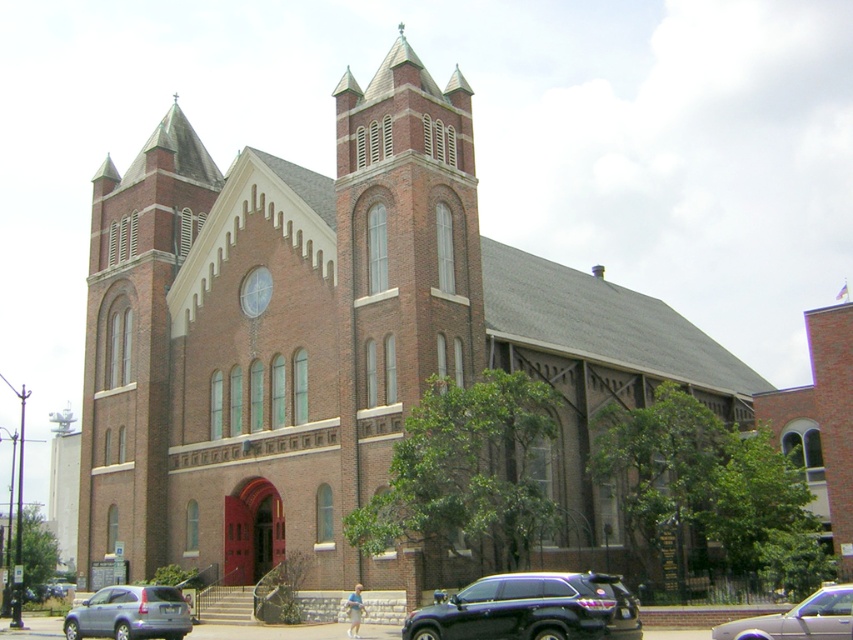
Does black matte suv at lower center appear on the left side of metallic gray suv at lower left?

Incorrect, black matte suv at lower center is not on the left side of metallic gray suv at lower left.

Between black matte suv at lower center and metallic gray suv at lower left, which one appears on the left side from the viewer's perspective?

From the viewer's perspective, metallic gray suv at lower left appears more on the left side.

Looking at this image, who is more forward, (439,620) or (181,608)?

Point (439,620) is more forward.

This screenshot has width=853, height=640. Identify the location of black matte suv at lower center. (531, 609).

Between metallic gray suv at lower left and metallic silver sedan at lower right, which one has more height?

metallic gray suv at lower left

Who is more forward, (73, 616) or (776, 621)?

Point (776, 621) is in front.

Find the location of a particular element. This screenshot has height=640, width=853. metallic gray suv at lower left is located at coordinates (129, 612).

Does black matte suv at lower center appear on the left side of metallic silver sedan at lower right?

Indeed, black matte suv at lower center is positioned on the left side of metallic silver sedan at lower right.

Is black matte suv at lower center shorter than metallic silver sedan at lower right?

No.

Based on the photo, measure the distance between black matte suv at lower center and camera.

The distance of black matte suv at lower center from camera is 117.14 feet.

Image resolution: width=853 pixels, height=640 pixels. Find the location of `black matte suv at lower center`. black matte suv at lower center is located at coordinates (531, 609).